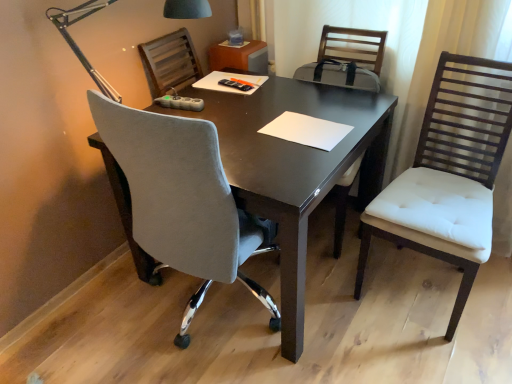
At what (x,y) coordinates should I click in order to perform the action: click on free spot below white tufted cushion chair at right, which is the second chair in left-to-right order (from a real-world perspective). Please return your answer as a coordinate pair (x, y). Looking at the image, I should click on (421, 286).